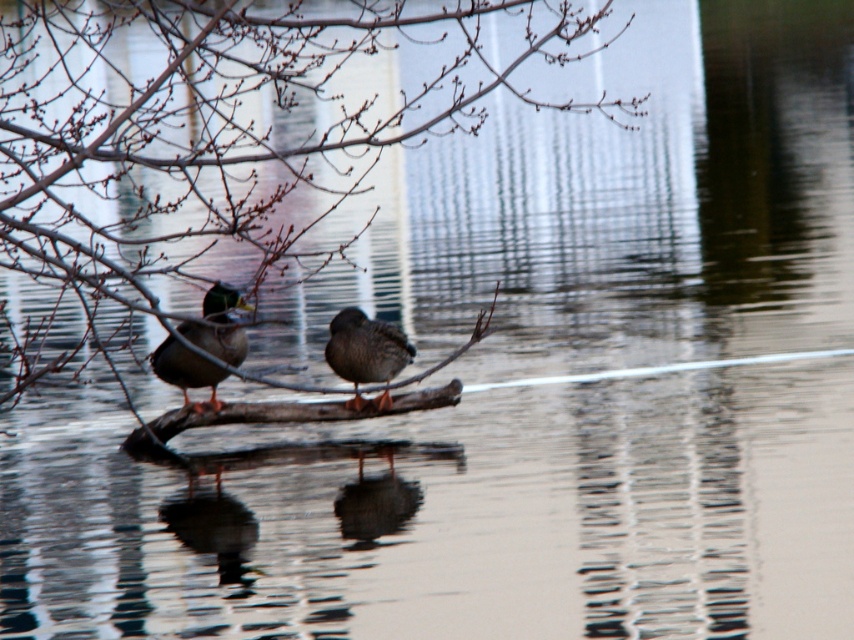
Which of these two, bare branches at center or brown matte duck at center, stands taller?

With more height is bare branches at center.

Does bare branches at center have a lesser width compared to brown matte duck at center?

No.

You are a GUI agent. You are given a task and a screenshot of the screen. Output one action in this format:
    pyautogui.click(x=<x>, y=<y>)
    Task: Click on the bare branches at center
    Image resolution: width=854 pixels, height=640 pixels.
    Given the screenshot: What is the action you would take?
    pyautogui.click(x=221, y=138)

Is shiny brown duck at left below brown matte duck at center?

No, shiny brown duck at left is not below brown matte duck at center.

Is point (215, 312) behind point (389, 352)?

That is False.

This screenshot has height=640, width=854. I want to click on shiny brown duck at left, so click(x=219, y=324).

The height and width of the screenshot is (640, 854). What do you see at coordinates (221, 138) in the screenshot?
I see `bare branches at center` at bounding box center [221, 138].

Does bare branches at center have a greater height compared to shiny brown duck at left?

Yes, bare branches at center is taller than shiny brown duck at left.

At what (x,y) coordinates should I click in order to perform the action: click on bare branches at center. Please return your answer as a coordinate pair (x, y). This screenshot has height=640, width=854. Looking at the image, I should click on pos(221,138).

Where is `bare branches at center`? Image resolution: width=854 pixels, height=640 pixels. bare branches at center is located at coordinates (221, 138).